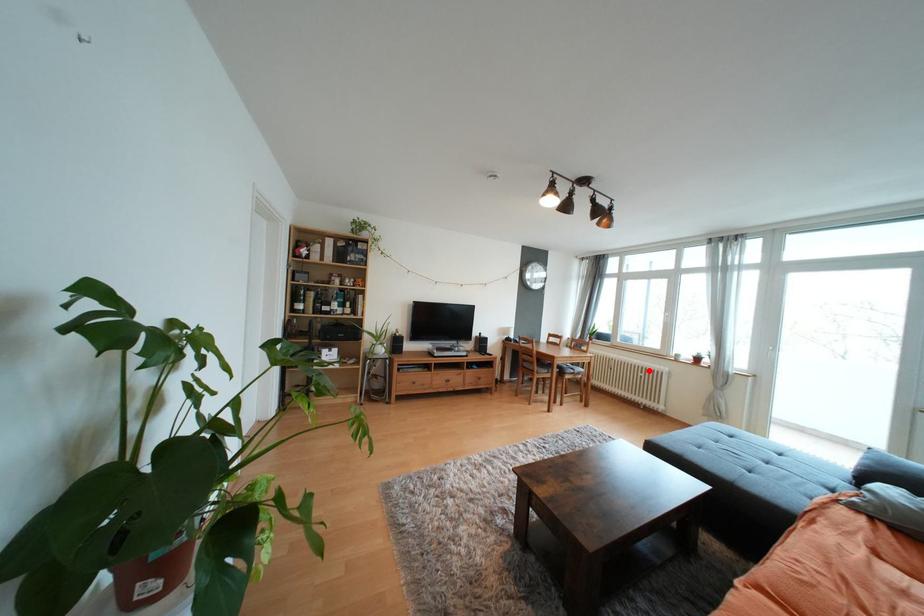
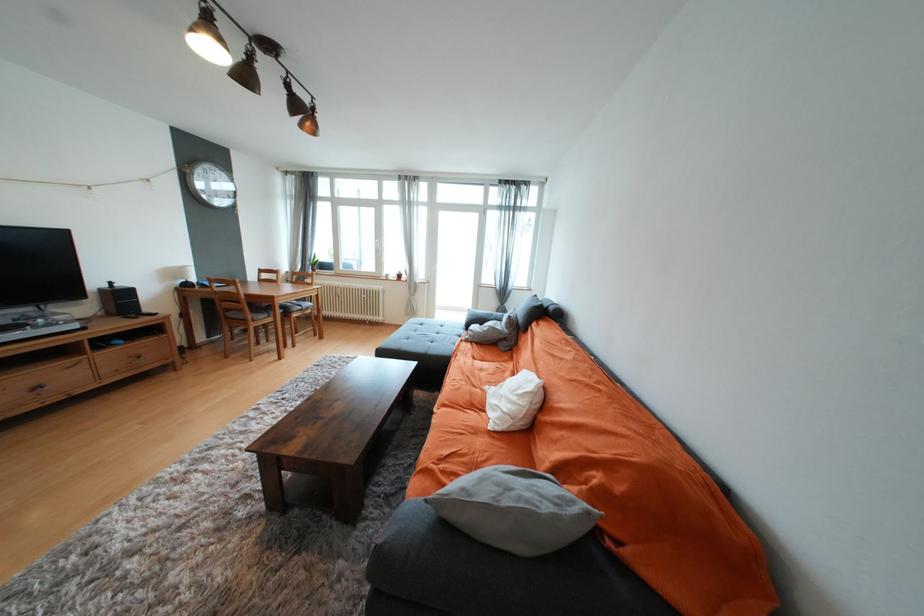
In the second image, find the point that corresponds to the highlighted location in the first image.

(371, 293)